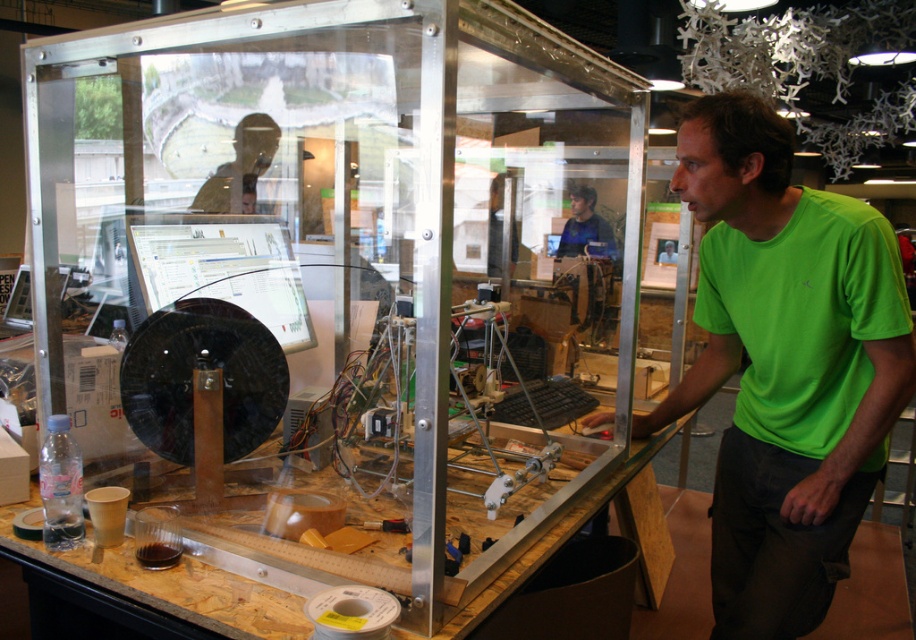
You are an engineer working in this maker space. You need to access both the matte black laptop at upper left and the blue fabric shirt at center. Which object is located lower in the scene?

The matte black laptop at upper left is below the blue fabric shirt at center, so the laptop is lower.

You are a technician who needs to place a tool on the transparent acrylic glass box at center. Where exactly should you place it?

The transparent acrylic glass box at center is located at point (340, 291), so you should place the tool precisely at that coordinate.

You are a visitor in the maker space and want to grab the blue fabric shirt at center. However, there is a matte black laptop at upper left in the way. Can you move the laptop to the right to access the shirt?

The matte black laptop at upper left is to the left of blue fabric shirt at center, so moving the laptop to the right would clear the path to the shirt.